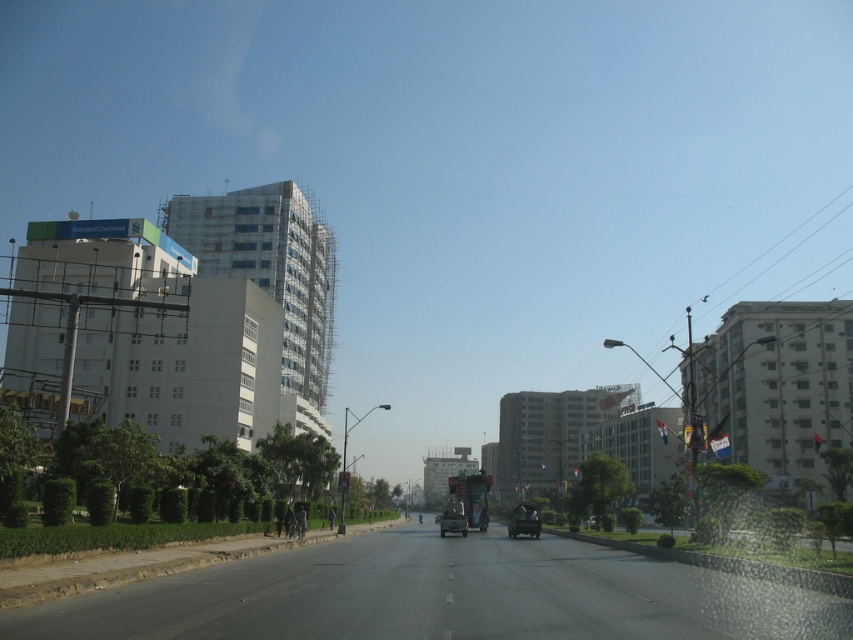
Who is shorter, metallic silver car at center or metallic silver truck at center?

metallic silver truck at center

Who is more forward, (512, 520) or (457, 524)?

Point (512, 520) is in front.

Between point (532, 525) and point (461, 509), which one is positioned behind?

The point (461, 509) is more distant.

Where is `metallic silver car at center`? The image size is (853, 640). metallic silver car at center is located at coordinates (523, 522).